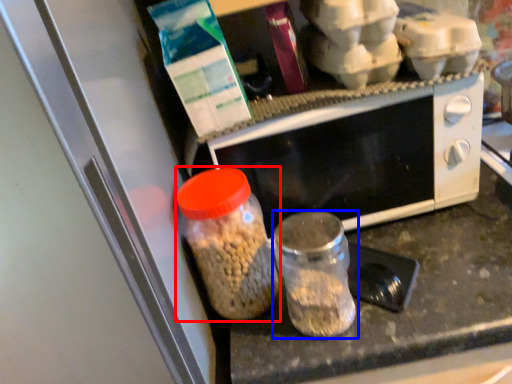
Question: Which object appears closest to the camera in this image, bottle (highlighted by a red box) or bottle (highlighted by a blue box)?

Choices:
 (A) bottle
 (B) bottle

Answer: (B)